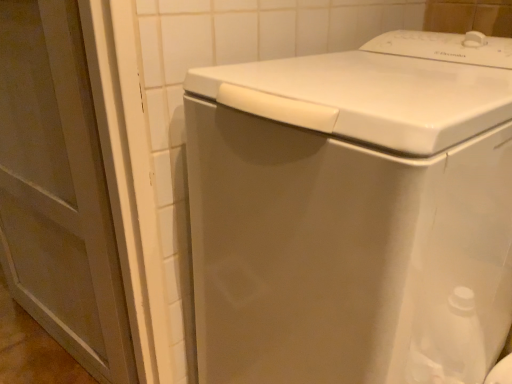
What do you see at coordinates (350, 209) in the screenshot? I see `white glossy washing machine at center` at bounding box center [350, 209].

I want to click on white glossy washing machine at center, so click(350, 209).

The image size is (512, 384). Describe the element at coordinates (58, 190) in the screenshot. I see `matte white screen door at left` at that location.

Measure the distance between matte white screen door at left and camera.

The distance of matte white screen door at left from camera is 25.69 inches.

At what (x,y) coordinates should I click in order to perform the action: click on matte white screen door at left. Please return your answer as a coordinate pair (x, y). Image resolution: width=512 pixels, height=384 pixels. Looking at the image, I should click on (58, 190).

Locate an element on the screen. white glossy washing machine at center is located at coordinates (350, 209).

Based on the photo, can you confirm if white glossy washing machine at center is positioned to the left of matte white screen door at left?

No, white glossy washing machine at center is not to the left of matte white screen door at left.

Between white glossy washing machine at center and matte white screen door at left, which one is positioned behind?

matte white screen door at left is further from the camera.

Is point (216, 102) farther from viewer compared to point (96, 295)?

That is False.

From the image's perspective, relative to matte white screen door at left, is white glossy washing machine at center above or below?

Clearly, from the image's perspective, white glossy washing machine at center is below matte white screen door at left.

From a real-world perspective, between white glossy washing machine at center and matte white screen door at left, who is vertically lower?

white glossy washing machine at center, from a real-world perspective.

Considering the sizes of objects white glossy washing machine at center and matte white screen door at left in the image provided, who is wider, white glossy washing machine at center or matte white screen door at left?

With larger width is white glossy washing machine at center.

Which of these two, white glossy washing machine at center or matte white screen door at left, stands taller?

Standing taller between the two is matte white screen door at left.

Looking at the image, does white glossy washing machine at center seem bigger or smaller compared to matte white screen door at left?

white glossy washing machine at center is bigger than matte white screen door at left.

Is white glossy washing machine at center outside of matte white screen door at left?

That's correct, white glossy washing machine at center is outside of matte white screen door at left.

Is white glossy washing machine at center beside matte white screen door at left?

No.

Is white glossy washing machine at center turned away from matte white screen door at left?

No, white glossy washing machine at center is not facing the opposite direction of matte white screen door at left.

How distant is white glossy washing machine at center from matte white screen door at left?

A distance of 17.60 inches exists between white glossy washing machine at center and matte white screen door at left.

In the image, there is a matte white screen door at left. Identify the location of washing machine below it (from the image's perspective). The width and height of the screenshot is (512, 384). (350, 209).

Would you say matte white screen door at left is to the left or to the right of white glossy washing machine at center in the picture?

From the image, it's evident that matte white screen door at left is to the left of white glossy washing machine at center.

Between matte white screen door at left and white glossy washing machine at center, which one is positioned behind?

matte white screen door at left is more distant.

Is point (96, 230) closer to camera compared to point (306, 242)?

No.

From the image's perspective, is matte white screen door at left positioned above or below white glossy washing machine at center?

matte white screen door at left is situated higher than white glossy washing machine at center in the image.

From a real-world perspective, relative to white glossy washing machine at center, is matte white screen door at left vertically above or below?

From a real-world perspective, matte white screen door at left is physically above white glossy washing machine at center.

Does matte white screen door at left have a lesser width compared to white glossy washing machine at center?

Yes, matte white screen door at left is thinner than white glossy washing machine at center.

Is matte white screen door at left shorter than white glossy washing machine at center?

In fact, matte white screen door at left may be taller than white glossy washing machine at center.

In the scene shown: In terms of size, does matte white screen door at left appear bigger or smaller than white glossy washing machine at center?

In the image, matte white screen door at left appears to be smaller than white glossy washing machine at center.

Would you say white glossy washing machine at center is part of matte white screen door at left's contents?

No.

Is matte white screen door at left beside white glossy washing machine at center?

matte white screen door at left and white glossy washing machine at center are not in contact.

Is white glossy washing machine at center at the back of matte white screen door at left?

No.

What's the angular difference between matte white screen door at left and white glossy washing machine at center's facing directions?

The angle between the facing direction of matte white screen door at left and the facing direction of white glossy washing machine at center is 7.58 degrees.

How much distance is there between matte white screen door at left and white glossy washing machine at center?

The distance of matte white screen door at left from white glossy washing machine at center is 17.60 inches.

You are a GUI agent. You are given a task and a screenshot of the screen. Output one action in this format:
    pyautogui.click(x=<x>, y=<y>)
    Task: Click on the washing machine in front of the matte white screen door at left
    
    Given the screenshot: What is the action you would take?
    pyautogui.click(x=350, y=209)

Where is `washing machine below the matte white screen door at left (from the image's perspective)`? This screenshot has height=384, width=512. washing machine below the matte white screen door at left (from the image's perspective) is located at coordinates (350, 209).

The height and width of the screenshot is (384, 512). Find the location of `washing machine to the right of matte white screen door at left`. washing machine to the right of matte white screen door at left is located at coordinates (350, 209).